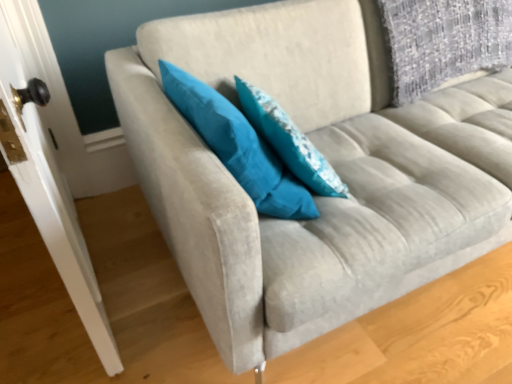
Question: Can we say white glossy door handle at left lies outside teal fabric pillow at center, the 2th pillow viewed from the left?

Choices:
 (A) yes
 (B) no

Answer: (A)

Question: Can you confirm if white glossy door handle at left is smaller than teal fabric pillow at center, the 2th pillow viewed from the left?

Choices:
 (A) no
 (B) yes

Answer: (A)

Question: From the image's perspective, is white glossy door handle at left beneath teal fabric pillow at center, which is the first pillow from right to left?

Choices:
 (A) no
 (B) yes

Answer: (B)

Question: Considering the relative sizes of white glossy door handle at left and teal fabric pillow at center, the 2th pillow viewed from the left, in the image provided, is white glossy door handle at left taller than teal fabric pillow at center, the 2th pillow viewed from the left,?

Choices:
 (A) yes
 (B) no

Answer: (A)

Question: From a real-world perspective, is white glossy door handle at left positioned under teal fabric pillow at center, the 2th pillow viewed from the left, based on gravity?

Choices:
 (A) yes
 (B) no

Answer: (A)

Question: From a real-world perspective, is teal fabric pillow at center, the 1th pillow in the left-to-right sequence, positioned above or below teal fabric pillow at center, the 2th pillow viewed from the left?

Choices:
 (A) below
 (B) above

Answer: (B)

Question: From the image's perspective, relative to teal fabric pillow at center, the 2th pillow viewed from the left, is teal fabric pillow at center, placed as the second pillow when sorted from right to left, above or below?

Choices:
 (A) above
 (B) below

Answer: (B)

Question: Looking at their shapes, would you say teal fabric pillow at center, placed as the second pillow when sorted from right to left, is wider or thinner than teal fabric pillow at center, which is the first pillow from right to left?

Choices:
 (A) thin
 (B) wide

Answer: (B)

Question: In terms of height, does teal fabric pillow at center, the 1th pillow in the left-to-right sequence, look taller or shorter compared to teal fabric pillow at center, the 2th pillow viewed from the left?

Choices:
 (A) short
 (B) tall

Answer: (B)

Question: Looking at their shapes, would you say teal fabric pillow at center, the 2th pillow viewed from the left, is wider or thinner than teal fabric pillow at center, placed as the second pillow when sorted from right to left?

Choices:
 (A) thin
 (B) wide

Answer: (A)

Question: From a real-world perspective, is teal fabric pillow at center, which is the first pillow from right to left, physically located above or below teal fabric pillow at center, the 1th pillow in the left-to-right sequence?

Choices:
 (A) above
 (B) below

Answer: (B)

Question: From their relative heights in the image, would you say teal fabric pillow at center, the 2th pillow viewed from the left, is taller or shorter than teal fabric pillow at center, placed as the second pillow when sorted from right to left?

Choices:
 (A) tall
 (B) short

Answer: (B)

Question: Considering the positions of point (251, 102) and point (258, 180), is point (251, 102) closer or farther from the camera than point (258, 180)?

Choices:
 (A) farther
 (B) closer

Answer: (A)

Question: Considering the positions of white glossy door handle at left and teal fabric pillow at center, the 1th pillow in the left-to-right sequence, in the image, is white glossy door handle at left bigger or smaller than teal fabric pillow at center, the 1th pillow in the left-to-right sequence,?

Choices:
 (A) big
 (B) small

Answer: (A)

Question: In the image, is white glossy door handle at left positioned in front of or behind teal fabric pillow at center, placed as the second pillow when sorted from right to left?

Choices:
 (A) front
 (B) behind

Answer: (A)